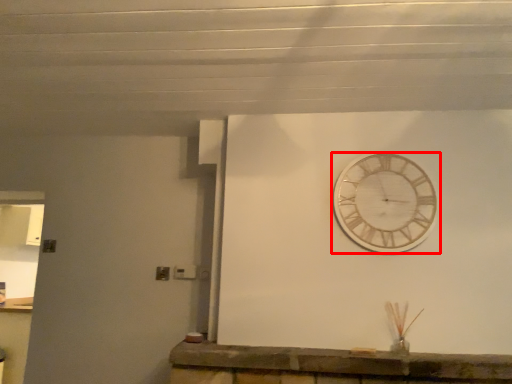
Question: Considering the relative positions of wall clock (annotated by the red box) and counter in the image provided, where is wall clock (annotated by the red box) located with respect to the staircase?

Choices:
 (A) right
 (B) left

Answer: (A)